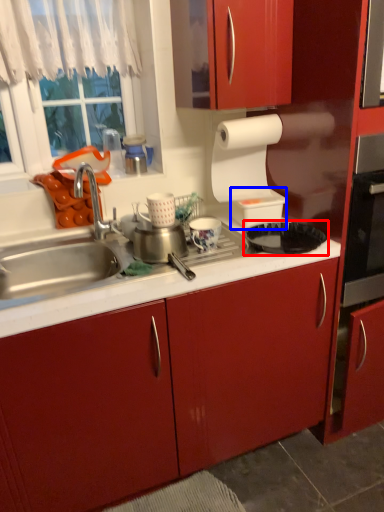
Question: Which object is closer to the camera taking this photo, kitchen appliance (highlighted by a red box) or appliance (highlighted by a blue box)?

Choices:
 (A) kitchen appliance
 (B) appliance

Answer: (A)